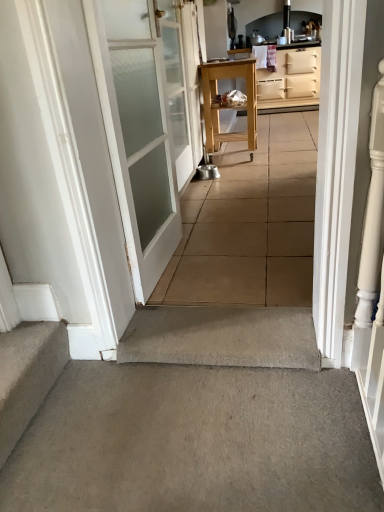
Question: From a real-world perspective, is natural wood table at center physically above gray concrete at center?

Choices:
 (A) yes
 (B) no

Answer: (A)

Question: Is natural wood table at center positioned in front of gray concrete at center?

Choices:
 (A) yes
 (B) no

Answer: (B)

Question: Is natural wood table at center beside gray concrete at center?

Choices:
 (A) yes
 (B) no

Answer: (B)

Question: Considering the relative sizes of natural wood table at center and gray concrete at center in the image provided, is natural wood table at center thinner than gray concrete at center?

Choices:
 (A) no
 (B) yes

Answer: (B)

Question: Is natural wood table at center facing towards gray concrete at center?

Choices:
 (A) no
 (B) yes

Answer: (A)

Question: In terms of width, does white frosted glass door at upper left, which is the second door in front-to-back order, look wider or thinner when compared to carpeted stairs at lower left?

Choices:
 (A) thin
 (B) wide

Answer: (B)

Question: Would you say white frosted glass door at upper left, which is the second door in front-to-back order, is inside or outside carpeted stairs at lower left?

Choices:
 (A) inside
 (B) outside

Answer: (B)

Question: From a real-world perspective, is white frosted glass door at upper left, positioned as the 1th door in back-to-front order, physically located above or below carpeted stairs at lower left?

Choices:
 (A) above
 (B) below

Answer: (A)

Question: Considering the positions of point (185, 98) and point (6, 435), is point (185, 98) closer or farther from the camera than point (6, 435)?

Choices:
 (A) closer
 (B) farther

Answer: (B)

Question: From the image's perspective, is gray concrete at center located above or below white frosted glass door at left, acting as the first door starting from the front?

Choices:
 (A) above
 (B) below

Answer: (B)

Question: Is gray concrete at center to the left or to the right of white frosted glass door at left, acting as the first door starting from the front, in the image?

Choices:
 (A) right
 (B) left

Answer: (A)

Question: From a real-world perspective, relative to white frosted glass door at left, acting as the first door starting from the front, is gray concrete at center vertically above or below?

Choices:
 (A) above
 (B) below

Answer: (B)

Question: Is point (241, 380) positioned closer to the camera than point (160, 152)?

Choices:
 (A) farther
 (B) closer

Answer: (B)

Question: From the image's perspective, is carpeted stairs at lower left located above or below beige matte cabinet at upper right?

Choices:
 (A) below
 (B) above

Answer: (A)

Question: Is carpeted stairs at lower left in front of or behind beige matte cabinet at upper right in the image?

Choices:
 (A) front
 (B) behind

Answer: (A)